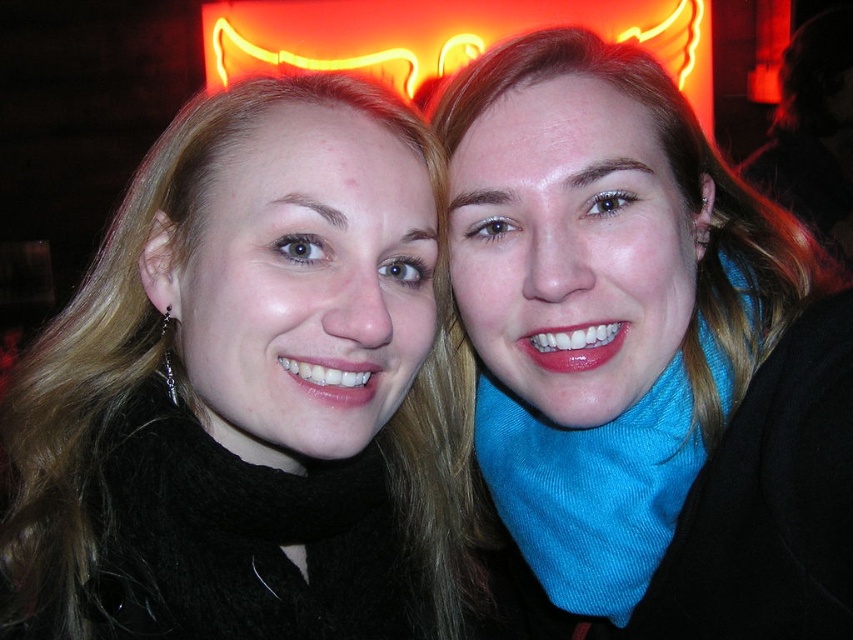
Question: Among these objects, which one is nearest to the camera?

Choices:
 (A) neon yellow sign at upper center
 (B) black fuzzy scarf at upper center

Answer: (B)

Question: Among these points, which one is farthest from the camera?

Choices:
 (A) (107, 464)
 (B) (367, 68)

Answer: (B)

Question: Is the position of blue corduroy scarf at right less distant than that of neon yellow sign at upper center?

Choices:
 (A) no
 (B) yes

Answer: (B)

Question: Can you confirm if black fuzzy scarf at upper center is thinner than blue corduroy scarf at right?

Choices:
 (A) yes
 (B) no

Answer: (B)

Question: Is black fuzzy scarf at upper center thinner than neon yellow sign at upper center?

Choices:
 (A) no
 (B) yes

Answer: (B)

Question: Which object appears farthest from the camera in this image?

Choices:
 (A) blue corduroy scarf at center
 (B) blue corduroy scarf at right
 (C) black fuzzy scarf at upper center
 (D) neon yellow sign at upper center

Answer: (D)